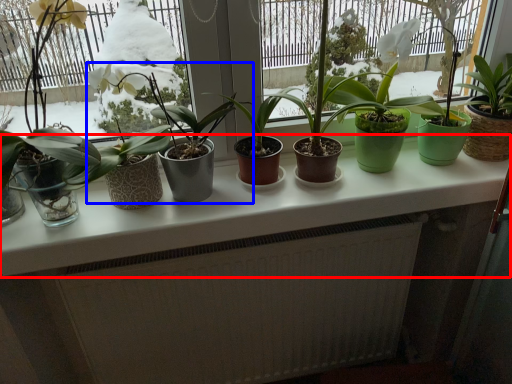
Question: Among these objects, which one is farthest to the camera, counter top (highlighted by a red box) or houseplant (highlighted by a blue box)?

Choices:
 (A) counter top
 (B) houseplant

Answer: (A)